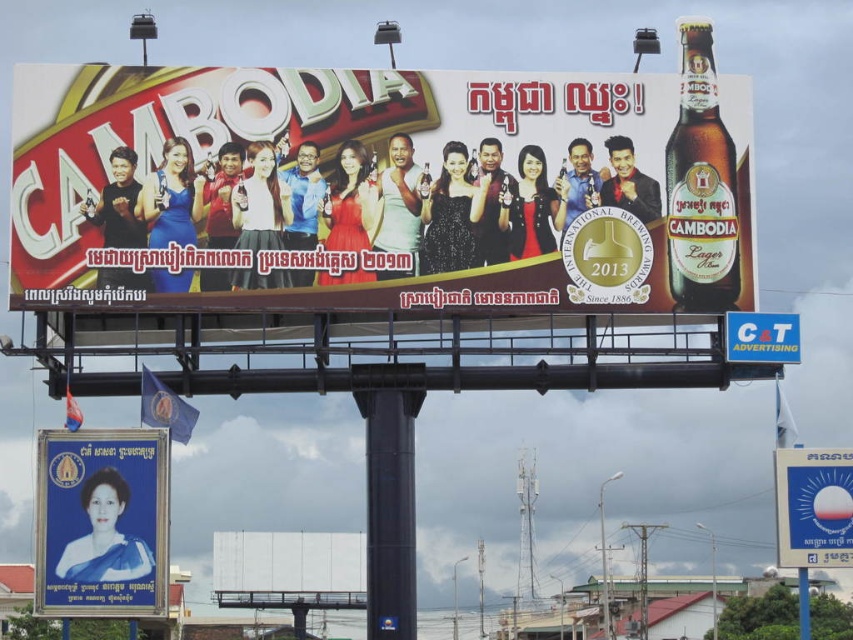
Question: Is blue fabric portrait at lower left bigger than white plastic sign at upper center?

Choices:
 (A) no
 (B) yes

Answer: (B)

Question: Which is nearer to the white plastic sign at lower right?

Choices:
 (A) white plastic sign at upper center
 (B) matte glass bottle at upper right

Answer: (A)

Question: Which point is closer to the camera taking this photo?

Choices:
 (A) (656, 144)
 (B) (708, 54)
 (C) (120, 524)
 (D) (780, 506)

Answer: (C)

Question: Is matte glass beer bottle at upper right behind white plastic sign at upper center?

Choices:
 (A) yes
 (B) no

Answer: (B)

Question: Is blue fabric portrait at lower left below matte glass bottle at upper right?

Choices:
 (A) yes
 (B) no

Answer: (A)

Question: Which point is closer to the camera?

Choices:
 (A) white plastic sign at upper center
 (B) matte glass beer bottle at upper right
 (C) white plastic sign at lower right
 (D) blue fabric portrait at lower left

Answer: (D)